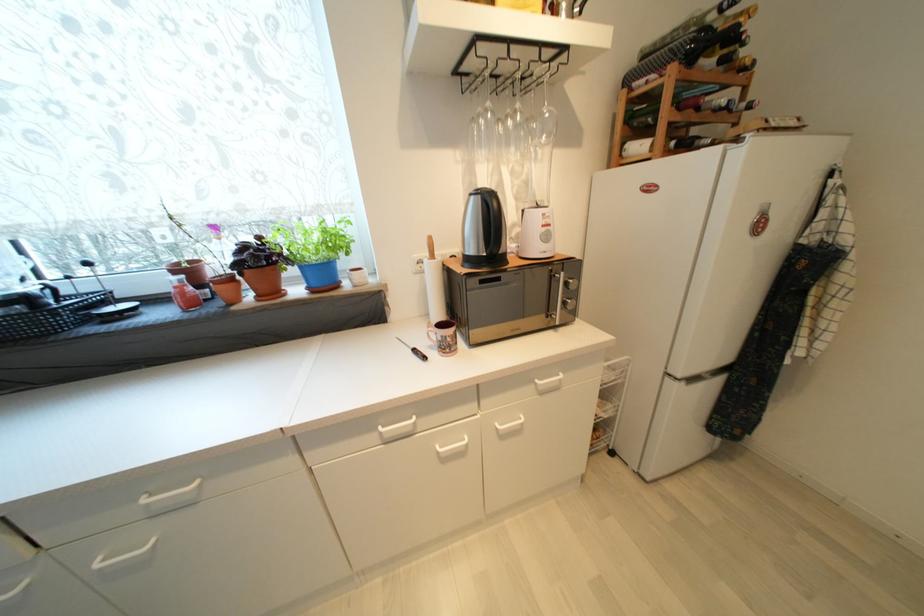
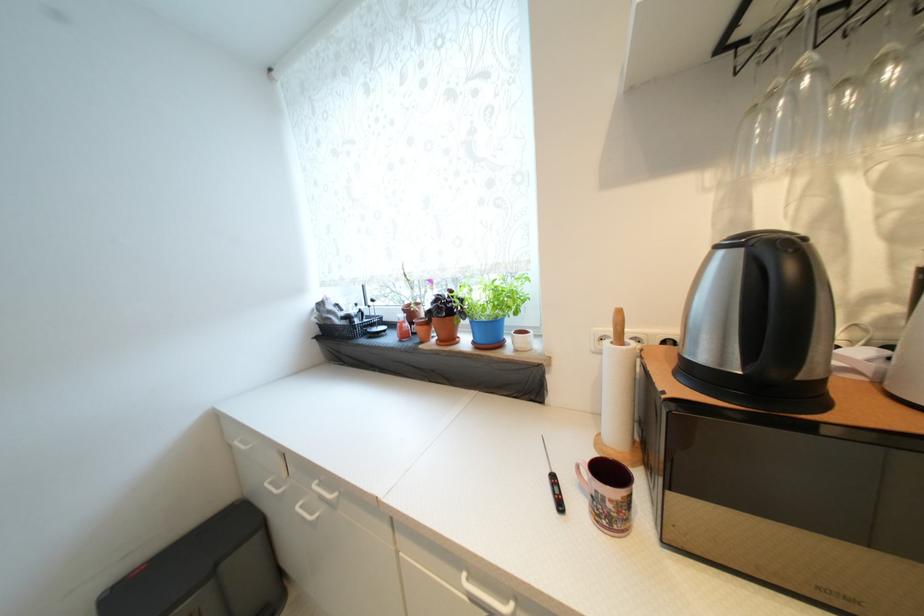
Find the pixel in the second image that matches the point at 102,567 in the first image.

(302, 509)